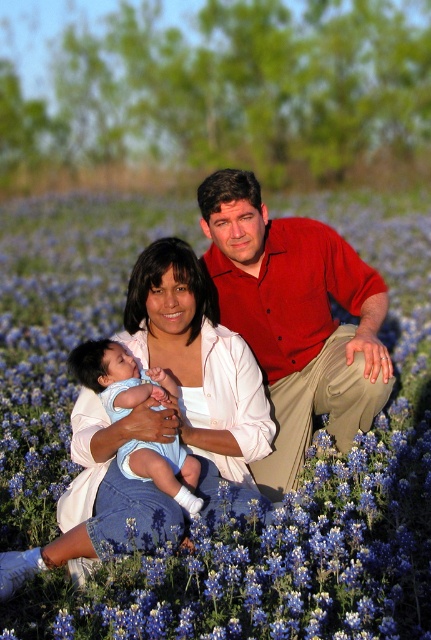
Question: Considering the relative positions of blue soft petals at center and light blue denim baby at center in the image provided, where is blue soft petals at center located with respect to light blue denim baby at center?

Choices:
 (A) above
 (B) below

Answer: (A)

Question: Considering the relative positions of blue soft petals at center and matte red shirt at center in the image provided, where is blue soft petals at center located with respect to matte red shirt at center?

Choices:
 (A) below
 (B) above

Answer: (B)

Question: Among these objects, which one is nearest to the camera?

Choices:
 (A) blue soft petals at center
 (B) light blue denim baby at center
 (C) matte red shirt at center

Answer: (A)

Question: Is blue soft petals at center positioned behind light blue denim baby at center?

Choices:
 (A) no
 (B) yes

Answer: (A)

Question: Which object is positioned closest to the blue soft petals at center?

Choices:
 (A) light blue denim baby at center
 (B) matte red shirt at center

Answer: (B)

Question: Which point appears farthest from the camera in this image?

Choices:
 (A) (100, 372)
 (B) (306, 406)
 (C) (316, 589)

Answer: (B)